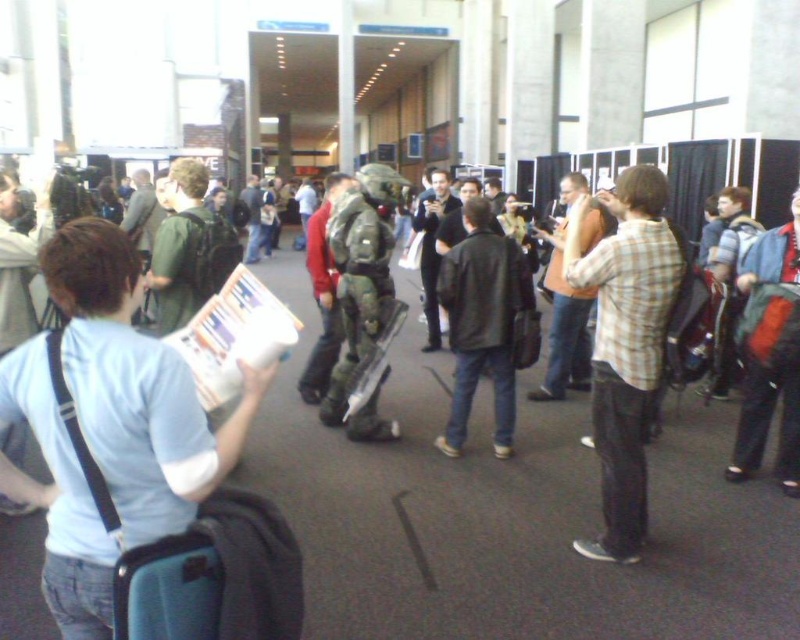
Is white matte t-shirt at center positioned in front of green matte armor at center?

Yes, it is.

Who is higher up, white matte t-shirt at center or green matte armor at center?

green matte armor at center is higher up.

Who is more forward, (220, 435) or (346, 385)?

Point (220, 435) is more forward.

I want to click on white matte t-shirt at center, so click(112, 426).

Between point (98, 584) and point (600, 332), which one is positioned behind?

Positioned behind is point (600, 332).

Can you confirm if white matte t-shirt at center is positioned to the left of plaid shirt at center?

Indeed, white matte t-shirt at center is positioned on the left side of plaid shirt at center.

Is point (44, 387) closer to viewer compared to point (630, 212)?

Yes.

Identify the location of white matte t-shirt at center. This screenshot has height=640, width=800. (112, 426).

Can you confirm if plaid shirt at center is positioned below leather jacket at center?

Correct, plaid shirt at center is located below leather jacket at center.

Is plaid shirt at center shorter than leather jacket at center?

No.

You are a GUI agent. You are given a task and a screenshot of the screen. Output one action in this format:
    pyautogui.click(x=<x>, y=<y>)
    Task: Click on the plaid shirt at center
    
    Given the screenshot: What is the action you would take?
    pyautogui.click(x=625, y=344)